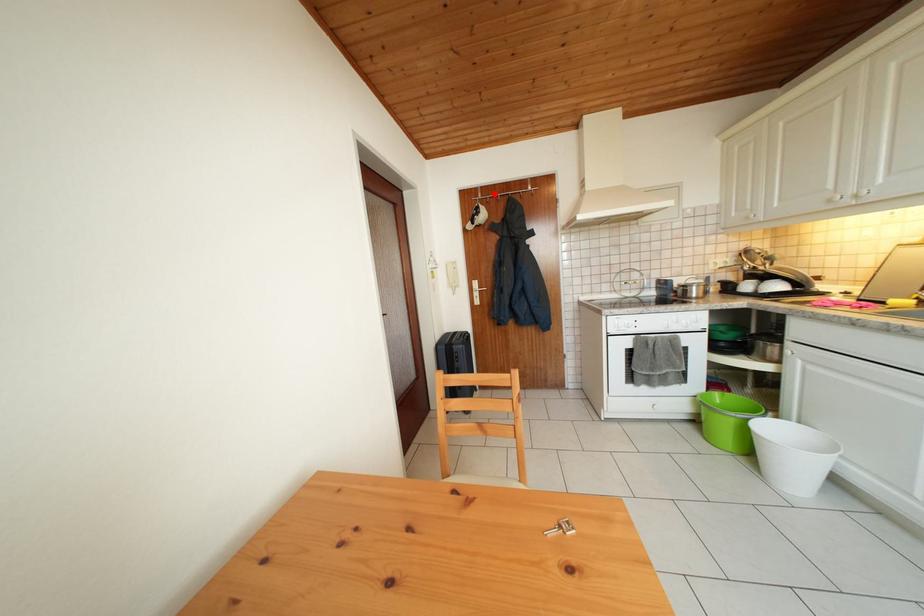
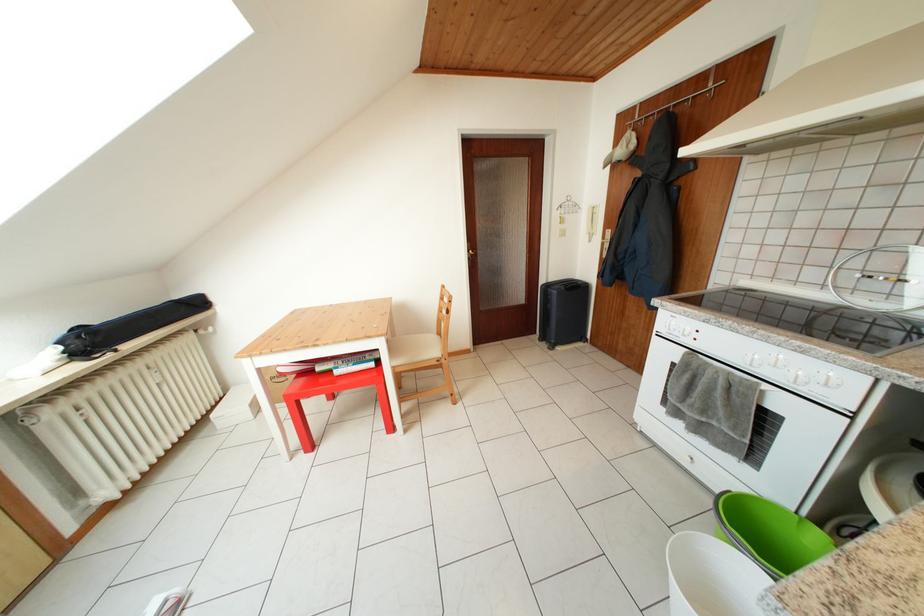
Locate, in the second image, the point that corresponds to the highlighted location in the first image.

(657, 108)